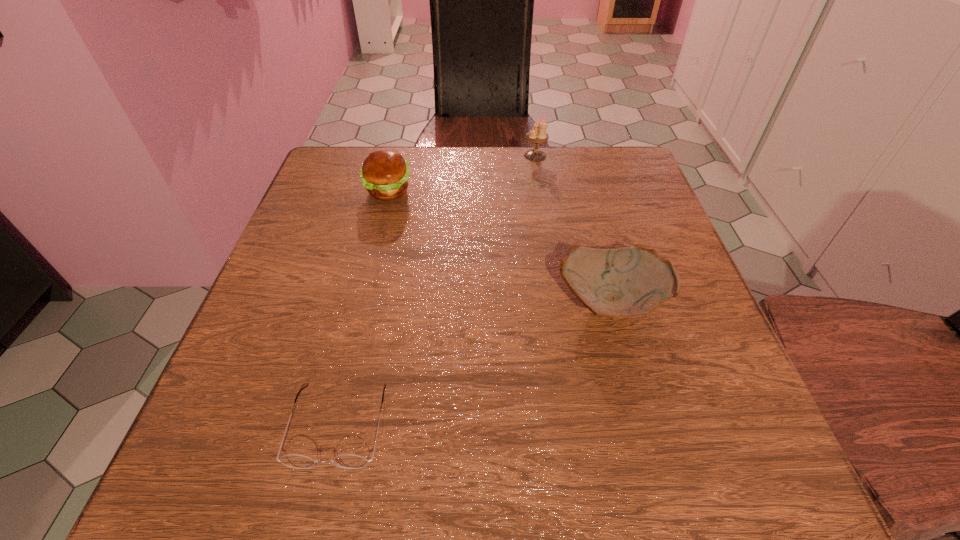
Where is `vacant area that lies between the tallest object and the third tallest object`? This screenshot has height=540, width=960. vacant area that lies between the tallest object and the third tallest object is located at coordinates (573, 230).

Where is `free spot between the hamburger and the farthest object`? The height and width of the screenshot is (540, 960). free spot between the hamburger and the farthest object is located at coordinates (462, 173).

The height and width of the screenshot is (540, 960). Identify the location of vacant area that lies between the pottery and the hamburger. (499, 247).

Identify the location of empty space that is in between the hamburger and the second shortest object. (499, 247).

Find the location of a particular element. vacant area between the spectacles and the second tallest object is located at coordinates (363, 309).

I want to click on empty space that is in between the second farthest object and the candle holder, so click(x=462, y=173).

Identify the location of object that can be found as the third closest to the second nearest object. This screenshot has height=540, width=960. click(538, 134).

Locate which object ranks second in proximity to the farthest object. Please provide its 2D coordinates. Your answer should be formatted as a tuple, i.e. [(x, y)], where the tuple contains the x and y coordinates of a point satisfying the conditions above.

[(629, 282)]

At what (x,y) coordinates should I click in order to perform the action: click on vacant space that satisfies the following two spatial constraints: 1. on the front side of the second nearest object; 2. on the left side of the farthest object. Please return your answer as a coordinate pair (x, y). Image resolution: width=960 pixels, height=540 pixels. Looking at the image, I should click on (560, 303).

Find the location of a particular element. This screenshot has height=540, width=960. free space that satisfies the following two spatial constraints: 1. on the front side of the hamburger; 2. on the right side of the third tallest object is located at coordinates (360, 303).